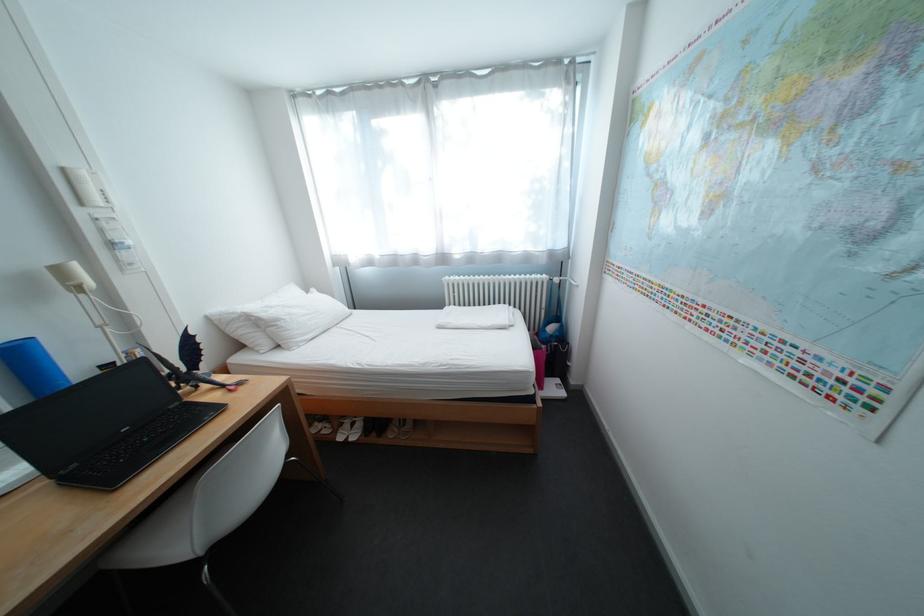
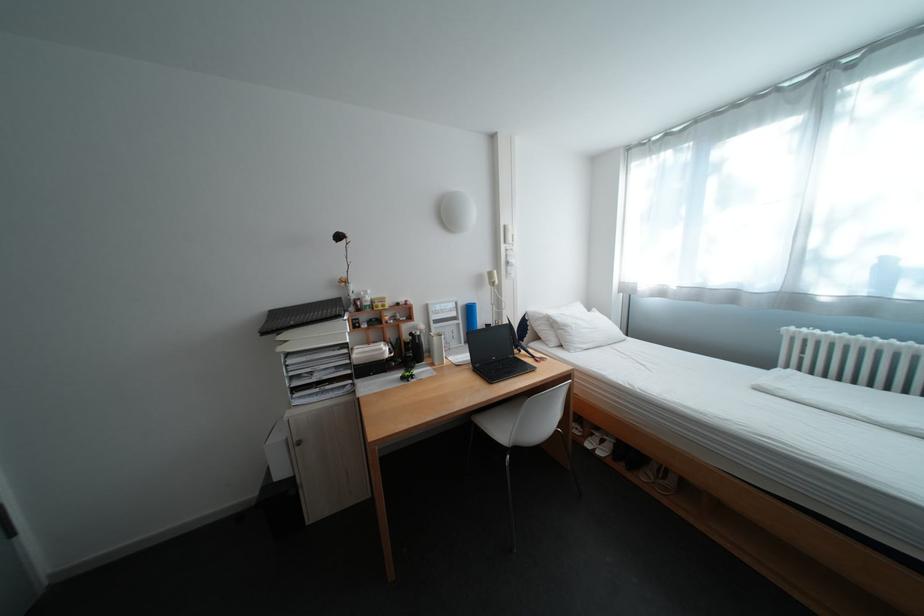
Question: The images are taken continuously from a first-person perspective. In which direction is your viewpoint rotating?

Choices:
 (A) Left
 (B) Right
 (C) Up
 (D) Down

Answer: (A)